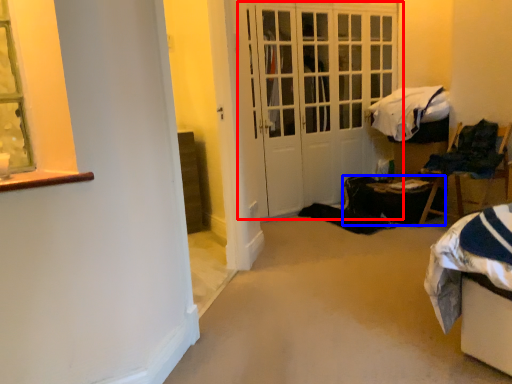
Question: Among these objects, which one is farthest to the camera, door (highlighted by a red box) or table (highlighted by a blue box)?

Choices:
 (A) door
 (B) table

Answer: (B)